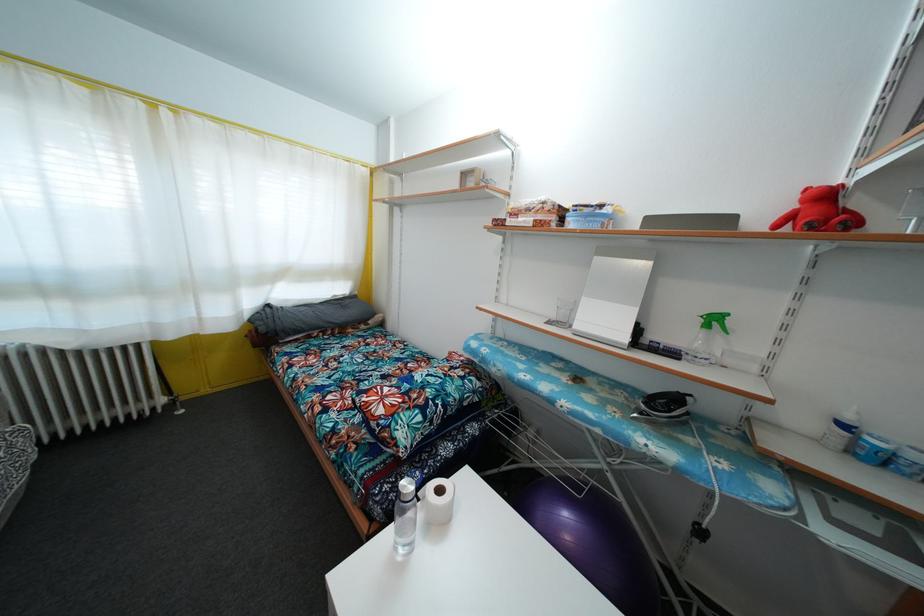
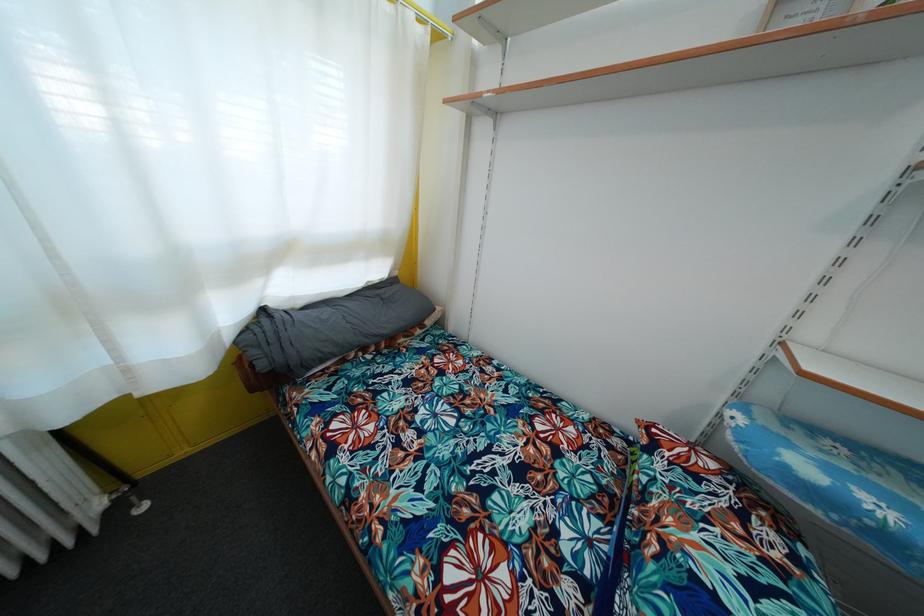
The images are taken continuously from a first-person perspective. In which direction are you moving?

The movement direction of the cameraman is left, forward.